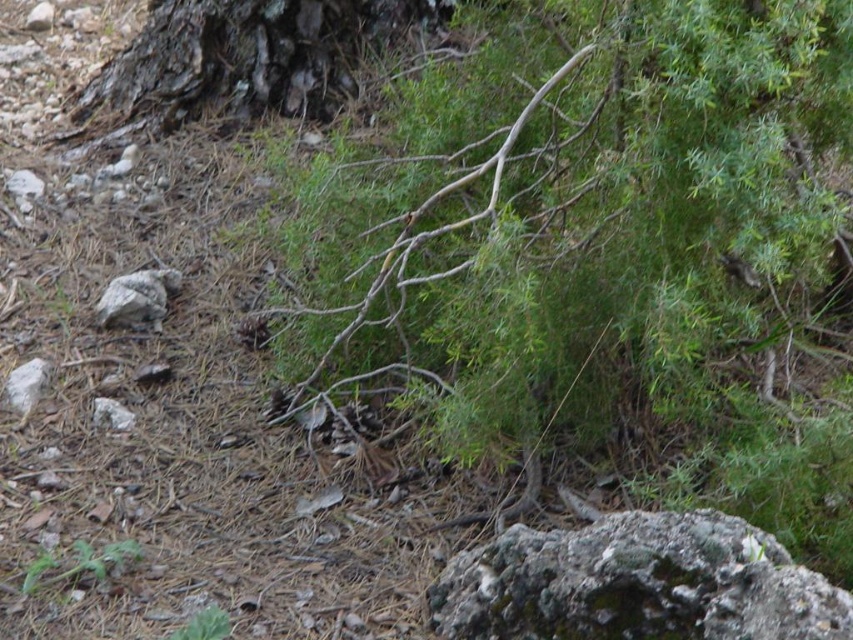
Between point (776, 595) and point (267, 4), which one is positioned behind?

Point (267, 4)

Which is above, gray rough rock at lower right or dark brown bark at upper left?

dark brown bark at upper left is above.

Which is behind, point (558, 588) or point (228, 38)?

The point (228, 38) is more distant.

Locate an element on the screen. gray rough rock at lower right is located at coordinates (636, 582).